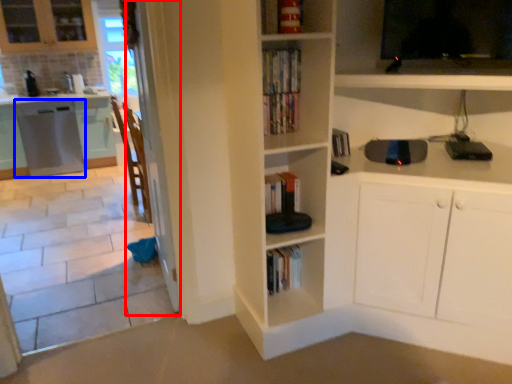
Question: Which of the following is the farthest to the observer, screen door (highlighted by a red box) or cabinetry (highlighted by a blue box)?

Choices:
 (A) screen door
 (B) cabinetry

Answer: (B)